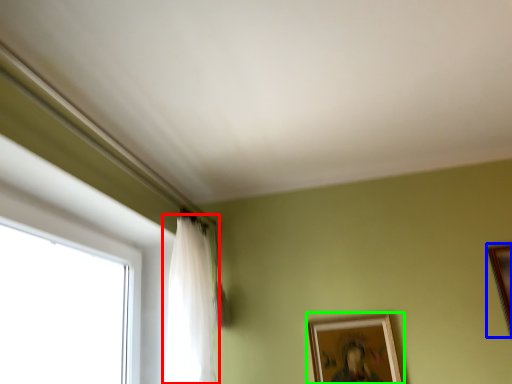
Question: Based on their relative distances, which object is nearer to curtain (highlighted by a red box)? Choose from picture frame (highlighted by a blue box) and picture frame (highlighted by a green box).

Choices:
 (A) picture frame
 (B) picture frame

Answer: (B)